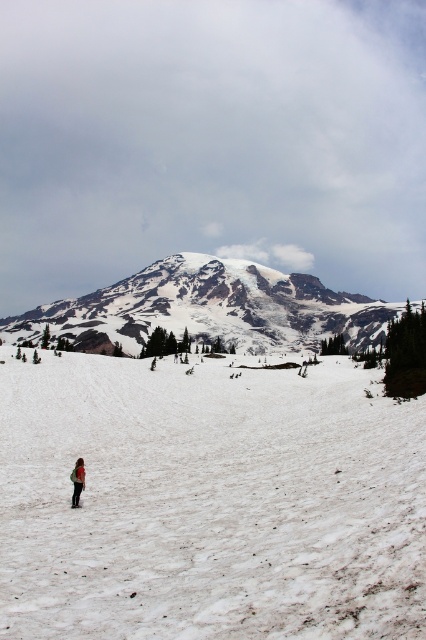
You are planning to build a snowman using the white snow at lower center and the red fabric jacket at lower left. Since the jacket is smaller, can you use it to cover the snowman?

The white snow at lower center has a larger width than the red fabric jacket at lower left, so yes, the jacket can be used to cover the snowman as it is smaller than the snow area available.